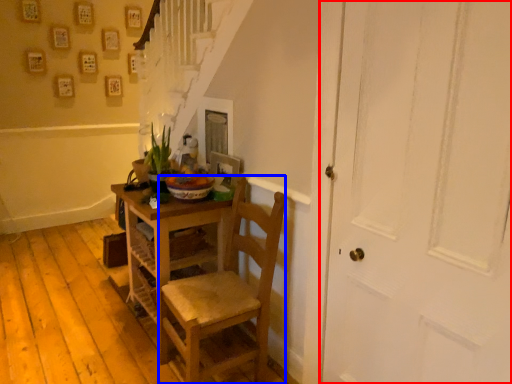
Question: Among these objects, which one is nearest to the camera, door (highlighted by a red box) or chair (highlighted by a blue box)?

Choices:
 (A) door
 (B) chair

Answer: (A)